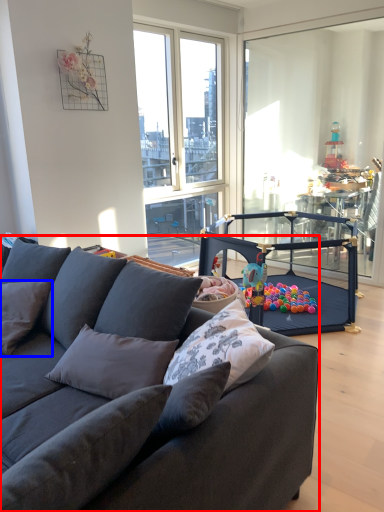
Question: Which object appears farthest to the camera in this image, studio couch (highlighted by a red box) or pillow (highlighted by a blue box)?

Choices:
 (A) studio couch
 (B) pillow

Answer: (B)